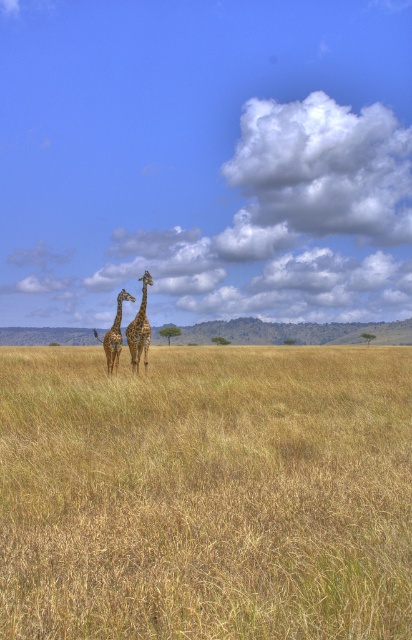
Question: Is spotted brown giraffe at center above brown textured giraffe at center?

Choices:
 (A) yes
 (B) no

Answer: (A)

Question: Which of the following is the closest to the observer?

Choices:
 (A) dry grass at center
 (B) spotted brown giraffe at center
 (C) brown textured giraffe at center

Answer: (A)

Question: Based on their relative distances, which object is farther from the dry grass at center?

Choices:
 (A) brown textured giraffe at center
 (B) spotted brown giraffe at center

Answer: (A)

Question: Which is farther from the brown textured giraffe at center?

Choices:
 (A) dry grass at center
 (B) spotted brown giraffe at center

Answer: (A)

Question: Is dry grass at center below spotted brown giraffe at center?

Choices:
 (A) no
 (B) yes

Answer: (B)

Question: Can you confirm if dry grass at center is positioned above brown textured giraffe at center?

Choices:
 (A) no
 (B) yes

Answer: (A)